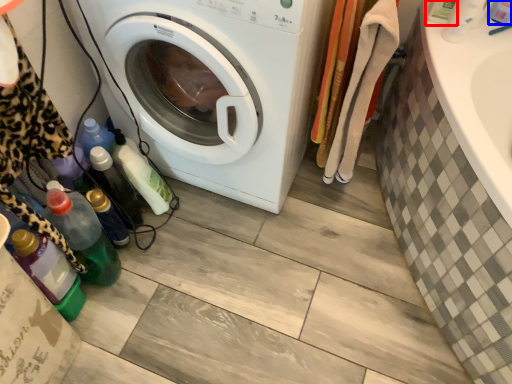
Question: Which point is closer to the camera, bottle (highlighted by a red box) or toiletry (highlighted by a blue box)?

Choices:
 (A) bottle
 (B) toiletry

Answer: (B)